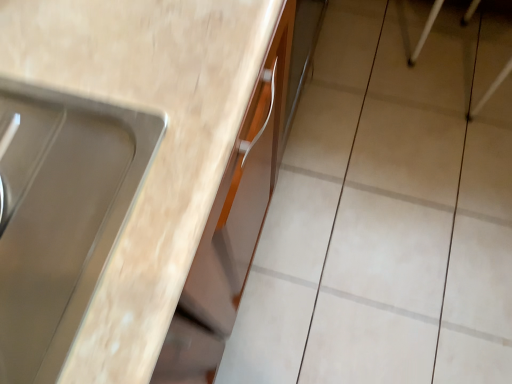
Find the location of a particular element. matte wood countertop at center is located at coordinates (159, 148).

The height and width of the screenshot is (384, 512). What do you see at coordinates (159, 148) in the screenshot?
I see `matte wood countertop at center` at bounding box center [159, 148].

What do you see at coordinates (425, 59) in the screenshot? The width and height of the screenshot is (512, 384). I see `beige ceramic tile at upper right` at bounding box center [425, 59].

Locate an element on the screen. beige ceramic tile at upper right is located at coordinates (425, 59).

You are a GUI agent. You are given a task and a screenshot of the screen. Output one action in this format:
    pyautogui.click(x=<x>, y=<y>)
    Task: Click on the matte wood countertop at center
    
    Given the screenshot: What is the action you would take?
    pyautogui.click(x=159, y=148)

Between beige ceramic tile at upper right and matte wood countertop at center, which one appears on the right side from the viewer's perspective?

Positioned to the right is beige ceramic tile at upper right.

Which object is further away from the camera, beige ceramic tile at upper right or matte wood countertop at center?

beige ceramic tile at upper right is more distant.

Between point (406, 7) and point (135, 53), which one is positioned in front?

Point (135, 53)

From the image's perspective, relative to matte wood countertop at center, is beige ceramic tile at upper right above or below?

beige ceramic tile at upper right is above matte wood countertop at center.

From a real-world perspective, does beige ceramic tile at upper right stand above matte wood countertop at center?

Actually, beige ceramic tile at upper right is physically below matte wood countertop at center in the real world.

Considering the sizes of objects beige ceramic tile at upper right and matte wood countertop at center in the image provided, who is thinner, beige ceramic tile at upper right or matte wood countertop at center?

beige ceramic tile at upper right.

Does beige ceramic tile at upper right have a lesser height compared to matte wood countertop at center?

Correct, beige ceramic tile at upper right is not as tall as matte wood countertop at center.

Based on their sizes in the image, would you say beige ceramic tile at upper right is bigger or smaller than matte wood countertop at center?

In the image, beige ceramic tile at upper right appears to be smaller than matte wood countertop at center.

Is beige ceramic tile at upper right spatially inside matte wood countertop at center, or outside of it?

beige ceramic tile at upper right is not inside matte wood countertop at center, it's outside.

Is beige ceramic tile at upper right not close to matte wood countertop at center?

Absolutely, beige ceramic tile at upper right is distant from matte wood countertop at center.

Is beige ceramic tile at upper right looking in the opposite direction of matte wood countertop at center?

No, matte wood countertop at center is not at the back of beige ceramic tile at upper right.

What's the angular difference between beige ceramic tile at upper right and matte wood countertop at center's facing directions?

90 degrees.

Where is `countertop on the left of the beige ceramic tile at upper right`? The image size is (512, 384). countertop on the left of the beige ceramic tile at upper right is located at coordinates (159, 148).

Would you say matte wood countertop at center is to the left or to the right of beige ceramic tile at upper right in the picture?

From the image, it's evident that matte wood countertop at center is to the left of beige ceramic tile at upper right.

Is matte wood countertop at center in front of or behind beige ceramic tile at upper right in the image?

Visually, matte wood countertop at center is located in front of beige ceramic tile at upper right.

Which is in front, point (37, 81) or point (416, 62)?

The point (37, 81) is more forward.

From the image's perspective, is matte wood countertop at center above beige ceramic tile at upper right?

Actually, matte wood countertop at center appears below beige ceramic tile at upper right in the image.

From a real-world perspective, is matte wood countertop at center on beige ceramic tile at upper right?

Yes, from a real-world perspective, matte wood countertop at center is above beige ceramic tile at upper right.

Does matte wood countertop at center have a greater width compared to beige ceramic tile at upper right?

Yes.

Considering the relative sizes of matte wood countertop at center and beige ceramic tile at upper right in the image provided, is matte wood countertop at center shorter than beige ceramic tile at upper right?

No.

Considering the relative sizes of matte wood countertop at center and beige ceramic tile at upper right in the image provided, is matte wood countertop at center smaller than beige ceramic tile at upper right?

No.

Does matte wood countertop at center contain beige ceramic tile at upper right?

No, beige ceramic tile at upper right is not surrounded by matte wood countertop at center.

Is matte wood countertop at center not close to beige ceramic tile at upper right?

Absolutely, matte wood countertop at center is distant from beige ceramic tile at upper right.

Is matte wood countertop at center facing away from beige ceramic tile at upper right?

No, matte wood countertop at center is not facing away from beige ceramic tile at upper right.

What's the angular difference between matte wood countertop at center and beige ceramic tile at upper right's facing directions?

matte wood countertop at center and beige ceramic tile at upper right are facing 90 degrees away from each other.

How far apart are matte wood countertop at center and beige ceramic tile at upper right?

matte wood countertop at center is 3.86 feet from beige ceramic tile at upper right.

This screenshot has height=384, width=512. Find the location of `countertop that appears below the beige ceramic tile at upper right (from the image's perspective)`. countertop that appears below the beige ceramic tile at upper right (from the image's perspective) is located at coordinates (159, 148).

The image size is (512, 384). In order to click on ceramic tile on the right of matte wood countertop at center in this screenshot , I will do `click(425, 59)`.

You are a GUI agent. You are given a task and a screenshot of the screen. Output one action in this format:
    pyautogui.click(x=<x>, y=<y>)
    Task: Click on the countertop above the beige ceramic tile at upper right (from a real-world perspective)
    Image resolution: width=512 pixels, height=384 pixels.
    Given the screenshot: What is the action you would take?
    pyautogui.click(x=159, y=148)